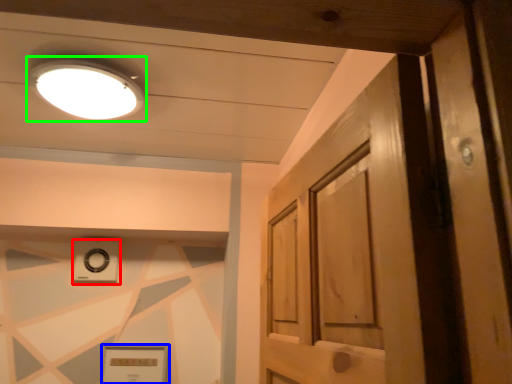
Question: Considering the real-world distances, which object is closest to knob (highlighted by a red box)? picture frame (highlighted by a blue box) or lighting (highlighted by a green box).

Choices:
 (A) picture frame
 (B) lighting

Answer: (A)